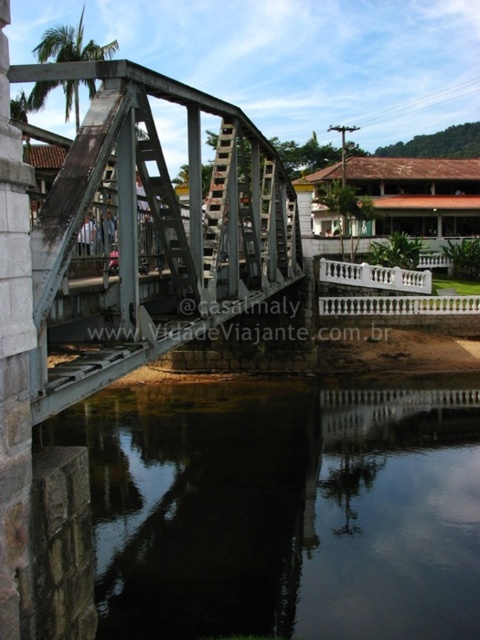
Question: Among these objects, which one is farthest from the camera?

Choices:
 (A) metallic gray bridge at center
 (B) black reflective water at lower center

Answer: (B)

Question: Does black reflective water at lower center come in front of metallic gray bridge at center?

Choices:
 (A) no
 (B) yes

Answer: (A)

Question: Which point is closer to the camera?

Choices:
 (A) black reflective water at lower center
 (B) metallic gray bridge at center

Answer: (B)

Question: Is black reflective water at lower center positioned behind metallic gray bridge at center?

Choices:
 (A) no
 (B) yes

Answer: (B)

Question: Is black reflective water at lower center thinner than metallic gray bridge at center?

Choices:
 (A) yes
 (B) no

Answer: (B)

Question: Which of the following is the closest to the observer?

Choices:
 (A) metallic gray bridge at center
 (B) black reflective water at lower center

Answer: (A)